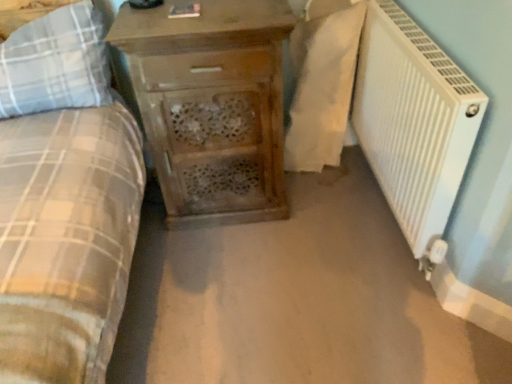
Question: In the image, is wooden chest of drawers at center positioned in front of or behind white textured radiator at right?

Choices:
 (A) front
 (B) behind

Answer: (B)

Question: From the image's perspective, is wooden chest of drawers at center positioned above or below white textured radiator at right?

Choices:
 (A) above
 (B) below

Answer: (A)

Question: Estimate the real-world distances between objects in this image. Which object is farther from the plaid fabric pillow at left?

Choices:
 (A) white textured radiator at right
 (B) wooden chest of drawers at center
 (C) white fabric at right

Answer: (A)

Question: Estimate the real-world distances between objects in this image. Which object is farther from the white fabric at right?

Choices:
 (A) plaid fabric pillow at left
 (B) white textured radiator at right
 (C) wooden chest of drawers at center

Answer: (A)